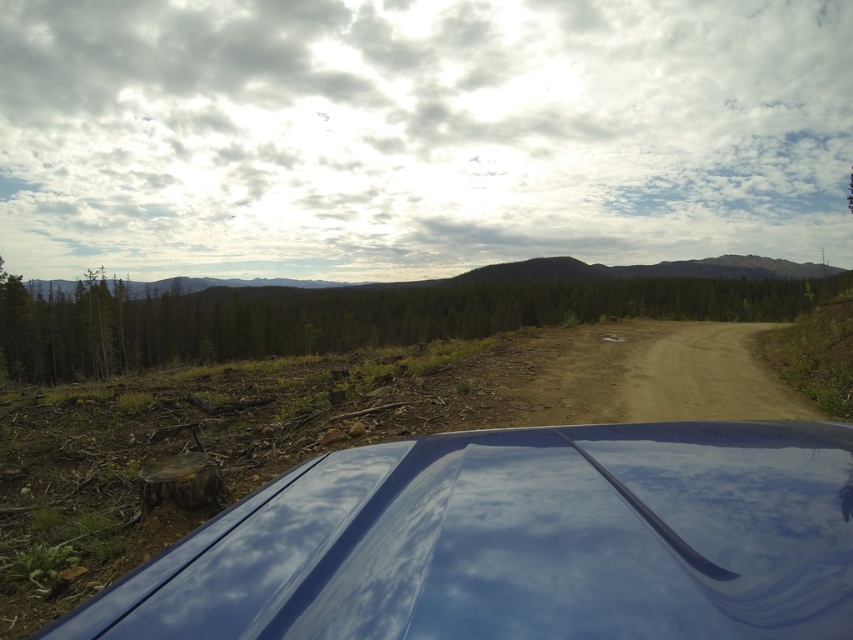
Find the location of a particular element. This screenshot has height=640, width=853. glossy blue car at lower center is located at coordinates (519, 541).

Who is more forward, (433,605) or (679,312)?

Point (433,605) is more forward.

Who is more forward, [309,536] or [259,332]?

Point [309,536] is in front.

What are the coordinates of `glossy blue car at lower center` in the screenshot? It's located at (519, 541).